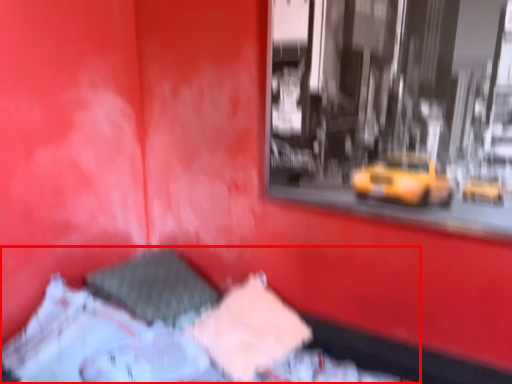
Question: From the image's perspective, where is bed (annotated by the red box) located relative to sheet?

Choices:
 (A) below
 (B) above

Answer: (A)